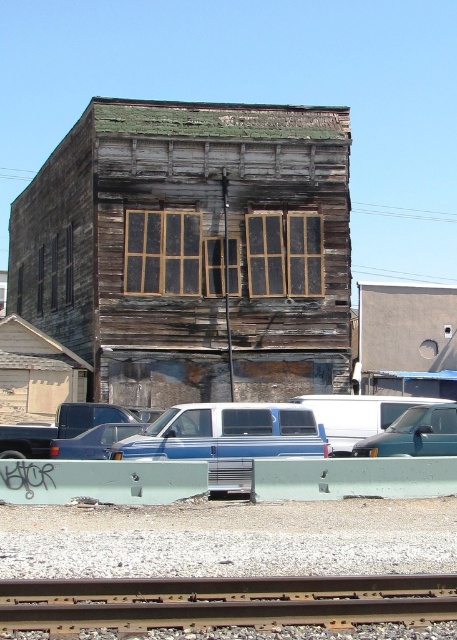
You are a delivery driver who needs to park your blue matte truck at center in a spot that requires a width of 2 meters. The brown metal train track at bottom runs across the parking area. Can you safely park your truck without crossing the track?

The brown metal train track at bottom is wider than the blue matte truck at center. Since the track is wider than the truck, the truck can safely park within the track width without crossing it. However, the required parking spot width is 2 meters, so ensure the truck fits within that space.

You are a delivery driver who needs to park your vehicle on the road in front of the old wooden building. You see a brown metal train track at bottom and a blue matte truck at center. Where should you park your vehicle to avoid the train track?

You should park your vehicle to the left of the blue matte truck at center because the brown metal train track at bottom is located to the right of the blue matte truck at center, so parking to the left would keep you clear of the tracks.